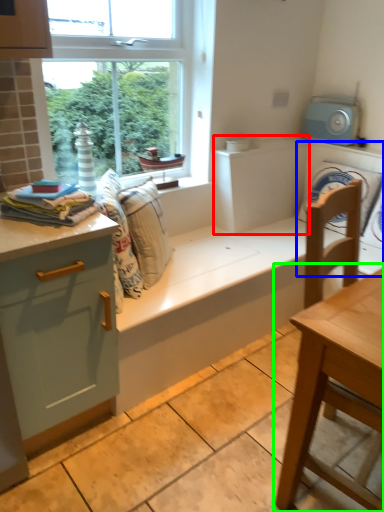
Question: Which object is the farthest from cabinetry (highlighted by a red box)? Choose among these: washing machine (highlighted by a blue box) or table (highlighted by a green box).

Choices:
 (A) washing machine
 (B) table

Answer: (B)